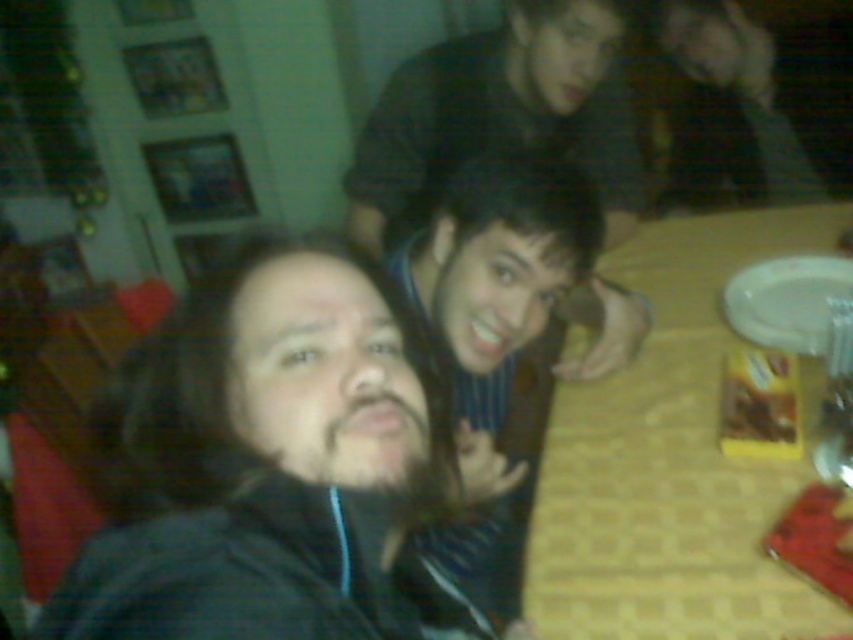
You are planning to place a new decorative item on the table in the image. The item is the same size as the striped shirt at center. Will it fit on the table next to the white glossy plate at right without overlapping?

The striped shirt at center is larger in size than the white glossy plate at right. Since the new item is the same size as the striped shirt at center, it may not fit next to the white glossy plate at right without overlapping, as it is bigger than the plate.

You are standing in the room and want to hand a gift to the person in the striped shirt at center. Based on their position, where should you approach from to ensure you are facing them directly?

The striped shirt at center is located at point (x=502, y=113), so you should approach from the front to ensure you are facing them directly.

You are at a party and want to place a small snack on the white glossy plate at right without disturbing the striped shirt at center. Is the plate accessible from your current position?

The striped shirt at center is located above the white glossy plate at right, so the plate is likely positioned lower and accessible without moving the striped shirt at center.